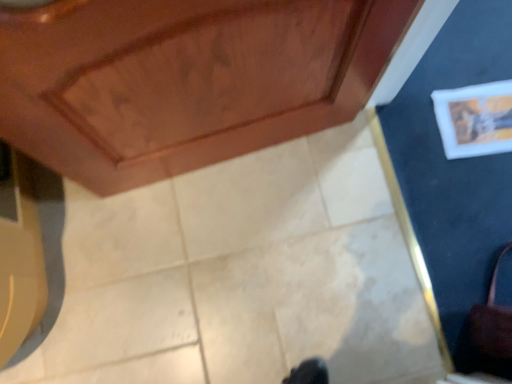
This screenshot has width=512, height=384. What do you see at coordinates (475, 119) in the screenshot?
I see `white matte picture frame at upper right` at bounding box center [475, 119].

What is the approximate width of white matte picture frame at upper right?

white matte picture frame at upper right is 12.05 inches wide.

In order to click on white matte picture frame at upper right in this screenshot , I will do `click(475, 119)`.

This screenshot has width=512, height=384. Identify the location of white matte picture frame at upper right. [x=475, y=119].